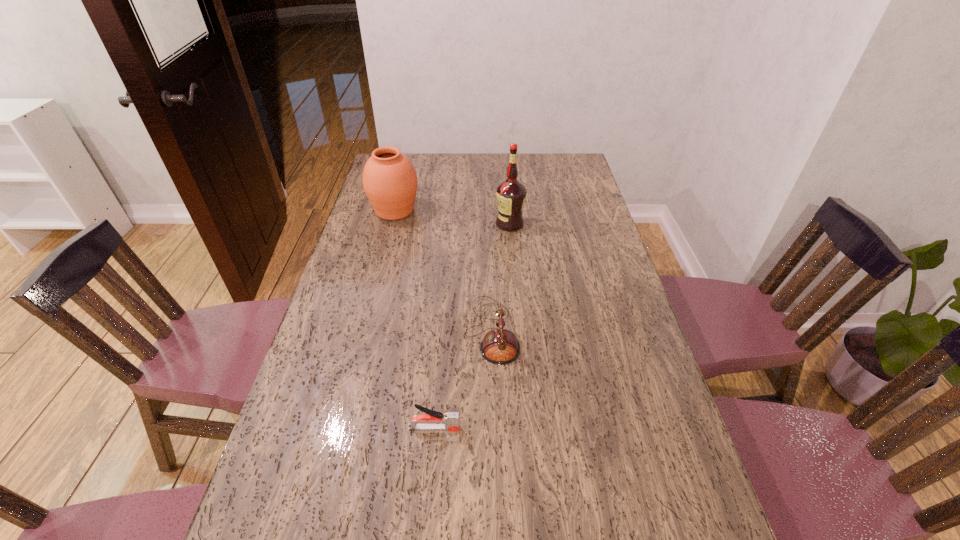
Find the location of a particular element. The width and height of the screenshot is (960, 540). free space that is in between the third farthest object and the tallest object is located at coordinates (501, 278).

You are a GUI agent. You are given a task and a screenshot of the screen. Output one action in this format:
    pyautogui.click(x=<x>, y=<y>)
    Task: Click on the free space between the telephone and the leftmost object
    
    Given the screenshot: What is the action you would take?
    pyautogui.click(x=444, y=271)

You are a GUI agent. You are given a task and a screenshot of the screen. Output one action in this format:
    pyautogui.click(x=<x>, y=<y>)
    Task: Click on the unoccupied area between the tallest object and the stapler
    The width and height of the screenshot is (960, 540).
    Given the screenshot: What is the action you would take?
    pyautogui.click(x=472, y=326)

You are a GUI agent. You are given a task and a screenshot of the screen. Output one action in this format:
    pyautogui.click(x=<x>, y=<y>)
    Task: Click on the free spot between the tallest object and the telephone
    
    Given the screenshot: What is the action you would take?
    pyautogui.click(x=501, y=278)

Choose which object is the nearest neighbor to the third object from right to left. Please provide its 2D coordinates. Your answer should be formatted as a tuple, i.e. [(x, y)], where the tuple contains the x and y coordinates of a point satisfying the conditions above.

[(500, 346)]

Identify the location of the closest object relative to the nearest object. (500, 346).